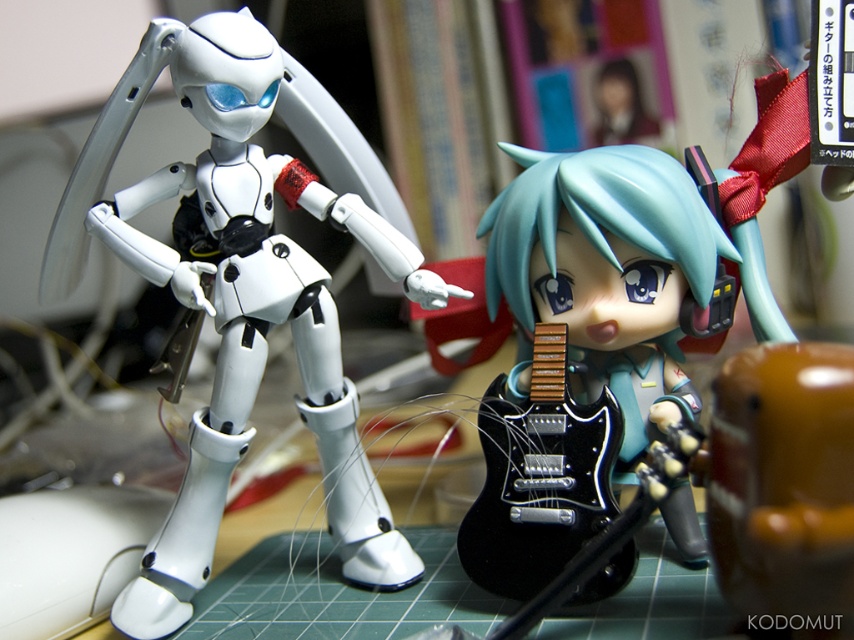
Question: Which object appears farthest from the camera in this image?

Choices:
 (A) white matte robot at left
 (B) semi-glossy black guitar at center

Answer: (A)

Question: Is semi-glossy black guitar at center behind black glossy electric guitar at center?

Choices:
 (A) yes
 (B) no

Answer: (B)

Question: Which point is closer to the camera?

Choices:
 (A) semi-glossy black guitar at center
 (B) black glossy electric guitar at center

Answer: (A)

Question: Can you confirm if white matte robot at left is thinner than black glossy electric guitar at center?

Choices:
 (A) yes
 (B) no

Answer: (B)

Question: Which of the following is the farthest from the observer?

Choices:
 (A) (521, 484)
 (B) (219, 330)

Answer: (B)

Question: Is white matte robot at left further to camera compared to black glossy electric guitar at center?

Choices:
 (A) yes
 (B) no

Answer: (A)